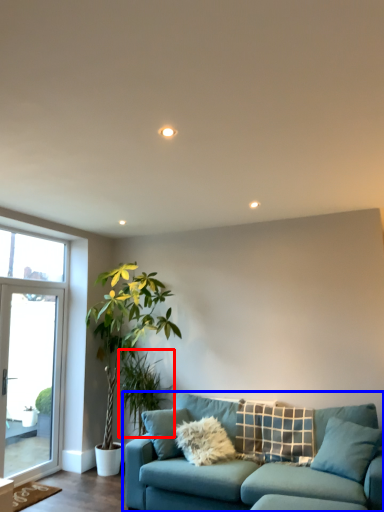
Question: Which object is further to the camera taking this photo, plant (highlighted by a red box) or studio couch (highlighted by a blue box)?

Choices:
 (A) plant
 (B) studio couch

Answer: (A)